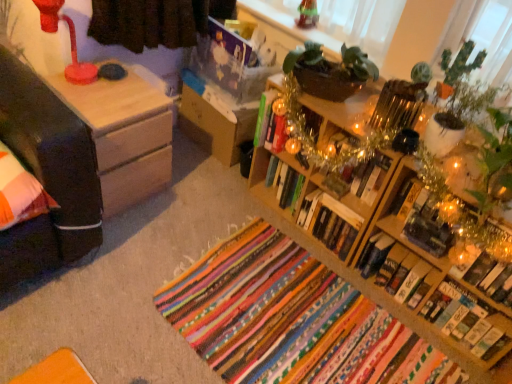
This screenshot has width=512, height=384. In order to click on blank space situated above wooden nightstand at left (from a real-world perspective) in this screenshot , I will do click(100, 88).